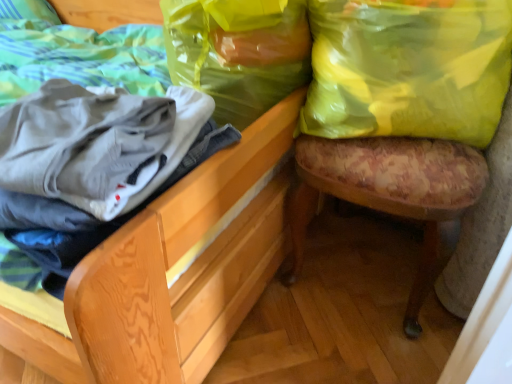
Question: Does translucent yellow plastic bag at upper right, which is the second shopping bag in right-to-left order, come in front of floral fabric stool at right?

Choices:
 (A) no
 (B) yes

Answer: (A)

Question: From a real-world perspective, is translucent yellow plastic bag at upper right, which is the second shopping bag in right-to-left order, positioned over floral fabric stool at right based on gravity?

Choices:
 (A) no
 (B) yes

Answer: (B)

Question: Is there a large distance between translucent yellow plastic bag at upper right, which is the second shopping bag in right-to-left order, and floral fabric stool at right?

Choices:
 (A) yes
 (B) no

Answer: (B)

Question: Considering the relative sizes of translucent yellow plastic bag at upper right, the 1th shopping bag viewed from the left, and floral fabric stool at right in the image provided, is translucent yellow plastic bag at upper right, the 1th shopping bag viewed from the left, bigger than floral fabric stool at right?

Choices:
 (A) yes
 (B) no

Answer: (B)

Question: Does translucent yellow plastic bag at upper right, which is the second shopping bag in right-to-left order, have a lesser height compared to floral fabric stool at right?

Choices:
 (A) yes
 (B) no

Answer: (A)

Question: From their relative heights in the image, would you say translucent yellow plastic bag at upper right, the 1th shopping bag viewed from the left, is taller or shorter than floral fabric stool at right?

Choices:
 (A) short
 (B) tall

Answer: (A)

Question: Considering the positions of point (245, 102) and point (478, 163), is point (245, 102) closer or farther from the camera than point (478, 163)?

Choices:
 (A) closer
 (B) farther

Answer: (B)

Question: In terms of width, does translucent yellow plastic bag at upper right, which is the second shopping bag in right-to-left order, look wider or thinner when compared to floral fabric stool at right?

Choices:
 (A) thin
 (B) wide

Answer: (A)

Question: In the image, is translucent yellow plastic bag at upper right, the 1th shopping bag viewed from the left, positioned in front of or behind floral fabric stool at right?

Choices:
 (A) front
 (B) behind

Answer: (B)

Question: From the image's perspective, is floral fabric stool at right positioned above or below wooden chair at lower right?

Choices:
 (A) above
 (B) below

Answer: (B)

Question: Would you say floral fabric stool at right is to the left or to the right of wooden chair at lower right in the picture?

Choices:
 (A) left
 (B) right

Answer: (B)

Question: From a real-world perspective, is floral fabric stool at right above or below wooden chair at lower right?

Choices:
 (A) above
 (B) below

Answer: (B)

Question: Looking at the image, does floral fabric stool at right seem bigger or smaller compared to wooden chair at lower right?

Choices:
 (A) small
 (B) big

Answer: (A)

Question: Would you say floral fabric stool at right is inside or outside yellow plastic bag at upper right, which ranks as the 1th shopping bag in right-to-left order?

Choices:
 (A) inside
 (B) outside

Answer: (B)

Question: From a real-world perspective, is floral fabric stool at right above or below yellow plastic bag at upper right, which ranks as the 1th shopping bag in right-to-left order?

Choices:
 (A) above
 (B) below

Answer: (B)